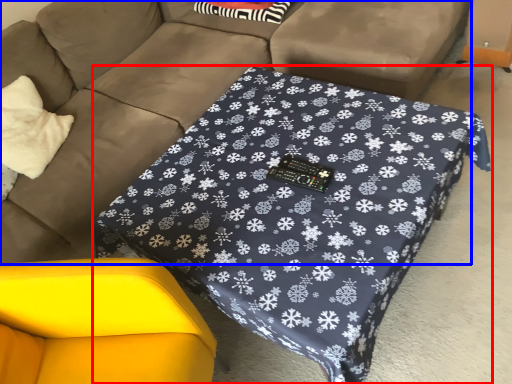
Question: Which of the following is the farthest to the observer, table (highlighted by a red box) or studio couch (highlighted by a blue box)?

Choices:
 (A) table
 (B) studio couch

Answer: (A)